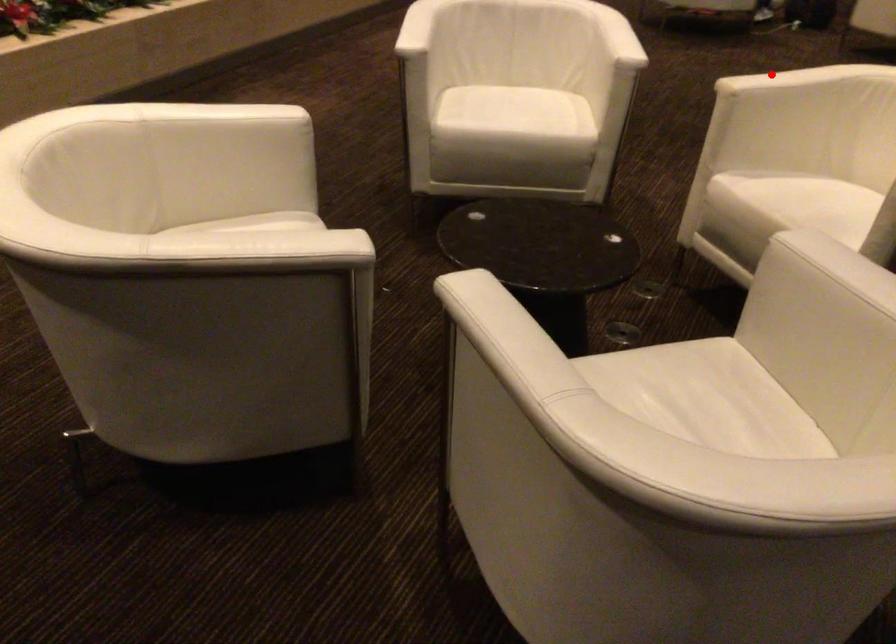
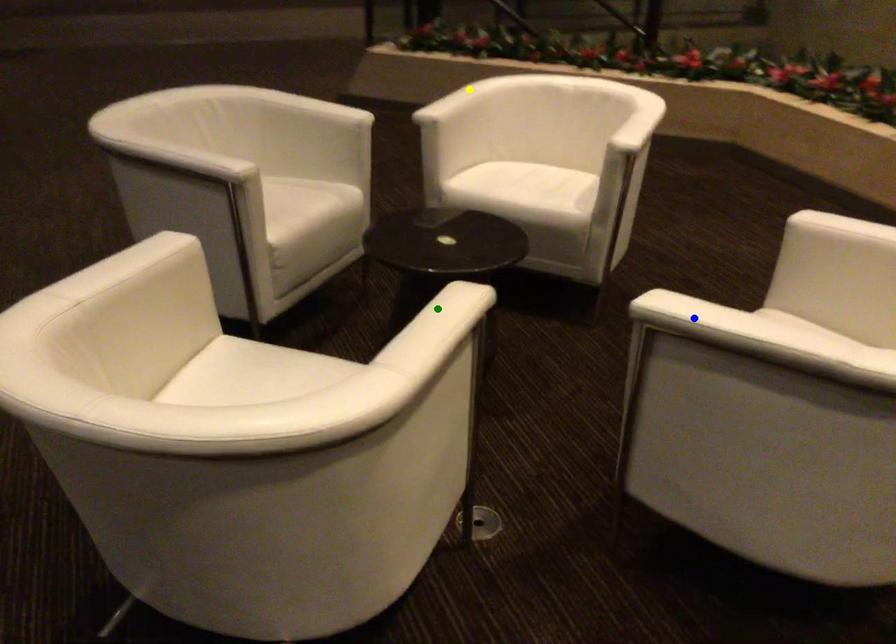
Question: I am providing you with two images of the same scene from different viewpoints. A red point is marked on the first image. You are given multiple points on the second image. Which point in image 2 represents the same 3d spot as the red point in image 1?

Choices:
 (A) green point
 (B) yellow point
 (C) blue point

Answer: (A)